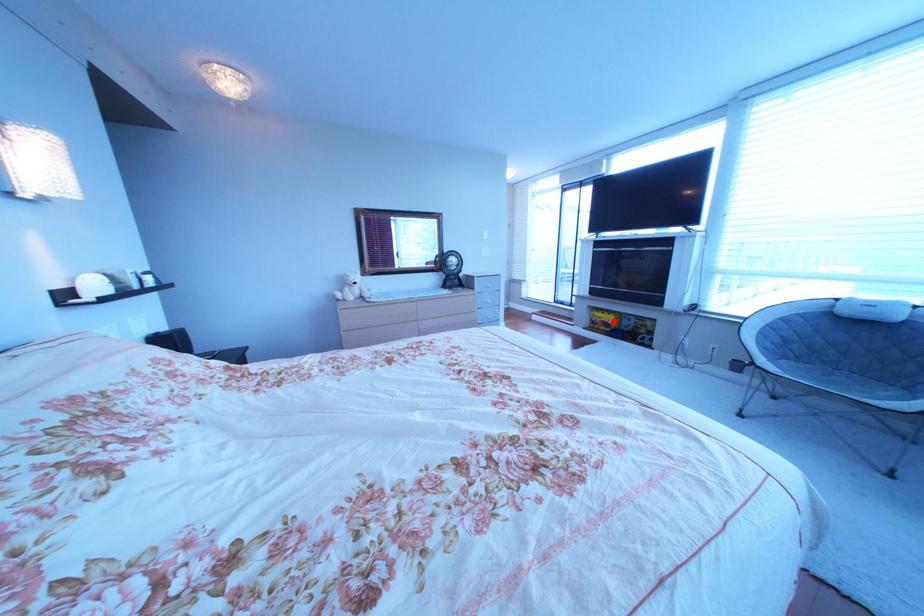
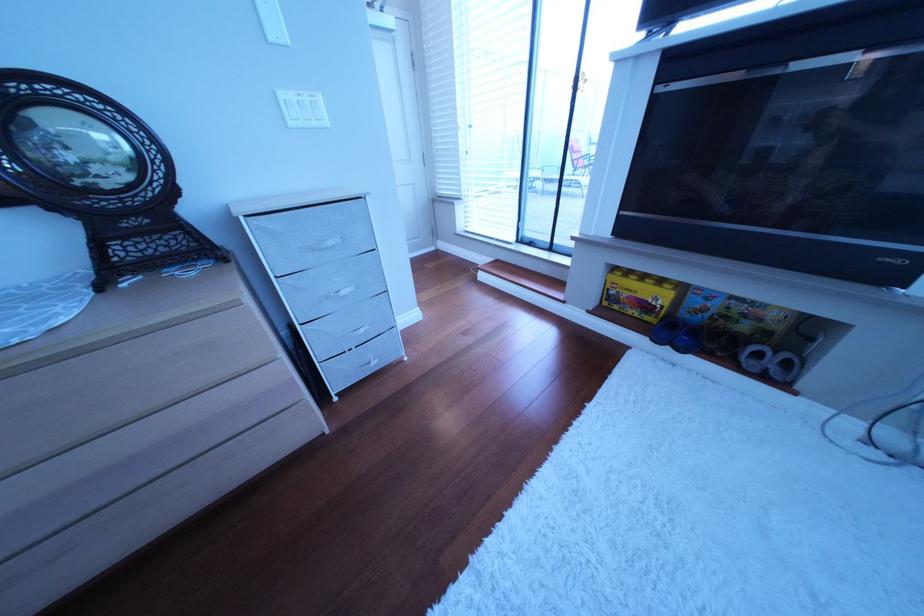
Where in the second image is the point corresponding to the highlighted location from the first image?

(640, 296)